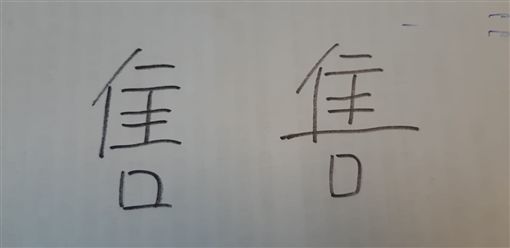
The image size is (510, 248). What are the coordinates of `corners` in the screenshot? It's located at (1, 2), (3, 244), (506, 243), (509, 0).